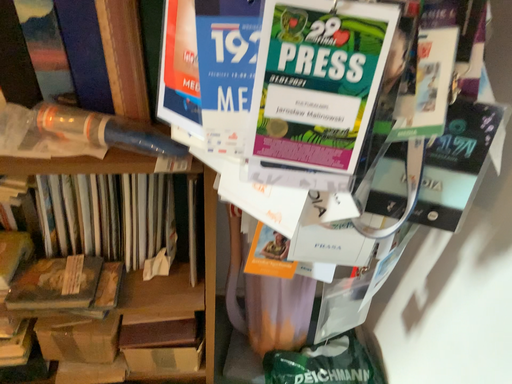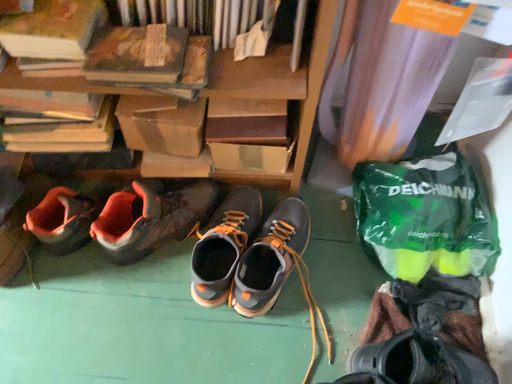
Question: Which way did the camera rotate in the video?

Choices:
 (A) rotated upward
 (B) rotated downward

Answer: (B)